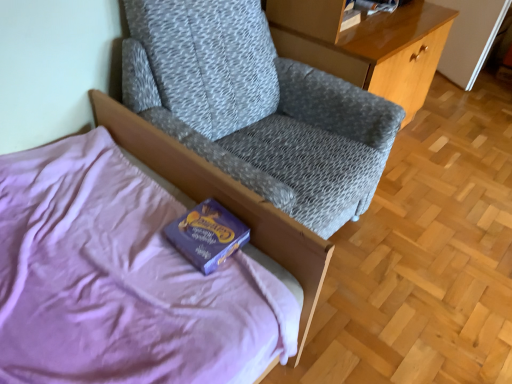
Question: Considering the positions of purple matte paperback book at lower left and textured gray fabric chair at upper center in the image, is purple matte paperback book at lower left wider or thinner than textured gray fabric chair at upper center?

Choices:
 (A) wide
 (B) thin

Answer: (B)

Question: From a real-world perspective, relative to textured gray fabric chair at upper center, is purple matte paperback book at lower left vertically above or below?

Choices:
 (A) below
 (B) above

Answer: (A)

Question: Estimate the real-world distances between objects in this image. Which object is farther from the wooden glossy desk at upper right?

Choices:
 (A) textured gray fabric chair at upper center
 (B) purple matte paperback book at lower left
 (C) purple soft bed at lower left

Answer: (B)

Question: Based on their relative distances, which object is nearer to the wooden glossy desk at upper right?

Choices:
 (A) purple matte paperback book at lower left
 (B) textured gray fabric chair at upper center
 (C) purple soft bed at lower left

Answer: (B)